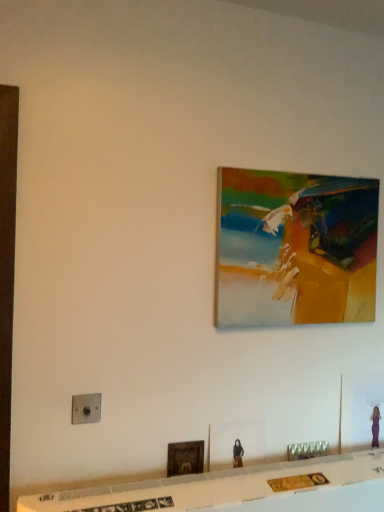
This screenshot has height=512, width=384. In order to click on satin silver switch at lower left in this screenshot , I will do `click(86, 408)`.

What is the approximate width of satin silver switch at lower left?

The width of satin silver switch at lower left is 1.11 inches.

The height and width of the screenshot is (512, 384). I want to click on metallic gold picture frame at lower center, which ranks as the 1th picture frame in bottom-to-top order, so click(x=185, y=458).

At what (x,y) coordinates should I click in order to perform the action: click on satin silver switch at lower left. Please return your answer as a coordinate pair (x, y). Looking at the image, I should click on (86, 408).

Between satin silver switch at lower left and metallic gold picture frame at lower center, acting as the first picture frame starting from the front, which one has more height?

With more height is metallic gold picture frame at lower center, acting as the first picture frame starting from the front.

Which object is positioned more to the left, satin silver switch at lower left or metallic gold picture frame at lower center, which ranks as the 1th picture frame in bottom-to-top order?

From the viewer's perspective, satin silver switch at lower left appears more on the left side.

Which of these two, satin silver switch at lower left or metallic gold picture frame at lower center, which ranks as the 1th picture frame in bottom-to-top order, is smaller?

satin silver switch at lower left.

Between satin silver switch at lower left and metallic gold decorative piece at lower center, which one has less height?

With less height is metallic gold decorative piece at lower center.

Does point (84, 399) come behind point (308, 444)?

No.

In the image, is satin silver switch at lower left positioned in front of or behind metallic gold decorative piece at lower center?

In the image, satin silver switch at lower left appears in front of metallic gold decorative piece at lower center.

Based on the photo, which point is more forward, (316, 451) or (286, 274)?

The point (286, 274) is closer.

Is the surface of metallic gold decorative piece at lower center in direct contact with oil painting at upper center, which ranks as the second picture frame in left-to-right order?

No, metallic gold decorative piece at lower center is not touching oil painting at upper center, which ranks as the second picture frame in left-to-right order.

From a real-world perspective, is metallic gold decorative piece at lower center beneath oil painting at upper center, which is the 1th picture frame from right to left?

Yes, from a real-world perspective, metallic gold decorative piece at lower center is under oil painting at upper center, which is the 1th picture frame from right to left.

Based on the photo, would you say oil painting at upper center, the 1th picture frame from the back, is part of metallic gold decorative piece at lower center's contents?

No, oil painting at upper center, the 1th picture frame from the back, is located outside of metallic gold decorative piece at lower center.

Visually, is metallic gold picture frame at lower center, placed as the 2th picture frame when sorted from back to front, positioned to the left or to the right of satin silver switch at lower left?

Based on their positions, metallic gold picture frame at lower center, placed as the 2th picture frame when sorted from back to front, is located to the right of satin silver switch at lower left.

How many degrees apart are the facing directions of metallic gold picture frame at lower center, placed as the 2th picture frame when sorted from back to front, and satin silver switch at lower left?

metallic gold picture frame at lower center, placed as the 2th picture frame when sorted from back to front, and satin silver switch at lower left are facing 3.1 degrees away from each other.

Between metallic gold picture frame at lower center, the 2th picture frame viewed from the top, and satin silver switch at lower left, which one has larger width?

Wider between the two is satin silver switch at lower left.

Is metallic gold picture frame at lower center, acting as the first picture frame starting from the front, taller than satin silver switch at lower left?

Correct, metallic gold picture frame at lower center, acting as the first picture frame starting from the front, is much taller as satin silver switch at lower left.

Is oil painting at upper center, which is the 1th picture frame from right to left, outside of satin silver switch at lower left?

Absolutely, oil painting at upper center, which is the 1th picture frame from right to left, is external to satin silver switch at lower left.

From the image's perspective, is oil painting at upper center, the second picture frame ordered from the bottom, under satin silver switch at lower left?

Actually, oil painting at upper center, the second picture frame ordered from the bottom, appears above satin silver switch at lower left in the image.

Which object is closer to the camera, oil painting at upper center, positioned as the first picture frame in top-to-bottom order, or satin silver switch at lower left?

Positioned in front is satin silver switch at lower left.

Consider the image. Is metallic gold picture frame at lower center, the 2th picture frame viewed from the top, shorter than oil painting at upper center, marked as the 2th picture frame in a front-to-back arrangement?

Yes.

Is metallic gold picture frame at lower center, acting as the first picture frame starting from the front, turned away from oil painting at upper center, which ranks as the second picture frame in left-to-right order?

No, metallic gold picture frame at lower center, acting as the first picture frame starting from the front, is not facing away from oil painting at upper center, which ranks as the second picture frame in left-to-right order.

Does metallic gold picture frame at lower center, acting as the first picture frame starting from the front, appear on the right side of oil painting at upper center, the second picture frame ordered from the bottom?

Incorrect, metallic gold picture frame at lower center, acting as the first picture frame starting from the front, is not on the right side of oil painting at upper center, the second picture frame ordered from the bottom.

Is point (314, 454) positioned before point (85, 408)?

No.

Does metallic gold decorative piece at lower center have a greater height compared to satin silver switch at lower left?

No, metallic gold decorative piece at lower center is not taller than satin silver switch at lower left.

Looking at this image, from a real-world perspective, is metallic gold decorative piece at lower center over satin silver switch at lower left?

No, from a real-world perspective, metallic gold decorative piece at lower center is not on top of satin silver switch at lower left.

Is metallic gold decorative piece at lower center inside the boundaries of satin silver switch at lower left, or outside?

The correct answer is: outside.

This screenshot has width=384, height=512. Find the location of `electric outlet that appears above the metallic gold picture frame at lower center, the 2th picture frame in the right-to-left sequence (from a real-world perspective)`. electric outlet that appears above the metallic gold picture frame at lower center, the 2th picture frame in the right-to-left sequence (from a real-world perspective) is located at coordinates (86, 408).

The height and width of the screenshot is (512, 384). Find the location of `electric outlet lying in front of the metallic gold decorative piece at lower center`. electric outlet lying in front of the metallic gold decorative piece at lower center is located at coordinates coord(86,408).

Looking at the image, which one is located closer to metallic gold picture frame at lower center, which ranks as the 1th picture frame in bottom-to-top order, metallic gold decorative piece at lower center or satin silver switch at lower left?

Among the two, satin silver switch at lower left is located nearer to metallic gold picture frame at lower center, which ranks as the 1th picture frame in bottom-to-top order.

Based on the photo, looking at the image, which one is located further to satin silver switch at lower left, metallic gold picture frame at lower center, which ranks as the 1th picture frame in bottom-to-top order, or oil painting at upper center, marked as the 2th picture frame in a front-to-back arrangement?

oil painting at upper center, marked as the 2th picture frame in a front-to-back arrangement, lies further to satin silver switch at lower left than the other object.

Which object lies further to the anchor point metallic gold picture frame at lower center, arranged as the 1th picture frame when viewed from the left, oil painting at upper center, positioned as the first picture frame in top-to-bottom order, or satin silver switch at lower left?

oil painting at upper center, positioned as the first picture frame in top-to-bottom order, is further to metallic gold picture frame at lower center, arranged as the 1th picture frame when viewed from the left.

Looking at this image, which object lies nearer to the anchor point metallic gold decorative piece at lower center, oil painting at upper center, marked as the 2th picture frame in a front-to-back arrangement, or metallic gold picture frame at lower center, acting as the first picture frame starting from the front?

metallic gold picture frame at lower center, acting as the first picture frame starting from the front.

Looking at the image, which one is located further to metallic gold decorative piece at lower center, metallic gold picture frame at lower center, acting as the first picture frame starting from the front, or oil painting at upper center, marked as the 2th picture frame in a front-to-back arrangement?

oil painting at upper center, marked as the 2th picture frame in a front-to-back arrangement.

Estimate the real-world distances between objects in this image. Which object is further from oil painting at upper center, positioned as the first picture frame in top-to-bottom order, satin silver switch at lower left or metallic gold picture frame at lower center, placed as the 2th picture frame when sorted from back to front?

Based on the image, satin silver switch at lower left appears to be further to oil painting at upper center, positioned as the first picture frame in top-to-bottom order.

When comparing their distances from metallic gold decorative piece at lower center, does oil painting at upper center, which ranks as the second picture frame in left-to-right order, or satin silver switch at lower left seem further?

satin silver switch at lower left lies further to metallic gold decorative piece at lower center than the other object.

Looking at the image, which one is located further to satin silver switch at lower left, metallic gold decorative piece at lower center or oil painting at upper center, the 1th picture frame from the back?

oil painting at upper center, the 1th picture frame from the back, is further to satin silver switch at lower left.

This screenshot has height=512, width=384. In order to click on electric outlet between oil painting at upper center, positioned as the first picture frame in top-to-bottom order, and metallic gold picture frame at lower center, acting as the first picture frame starting from the front, vertically in this screenshot , I will do `click(86, 408)`.

You are a GUI agent. You are given a task and a screenshot of the screen. Output one action in this format:
    pyautogui.click(x=<x>, y=<y>)
    Task: Click on the picture frame that lies between oil painting at upper center, which is the 1th picture frame from right to left, and metallic gold decorative piece at lower center from top to bottom
    This screenshot has height=512, width=384.
    Given the screenshot: What is the action you would take?
    pyautogui.click(x=185, y=458)